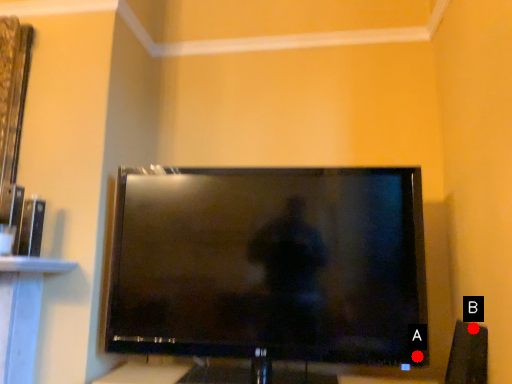
Question: Two points are circled on the image, labeled by A and B beside each circle. Which of the following is the farthest from the observer?

Choices:
 (A) A is further
 (B) B is further

Answer: (A)